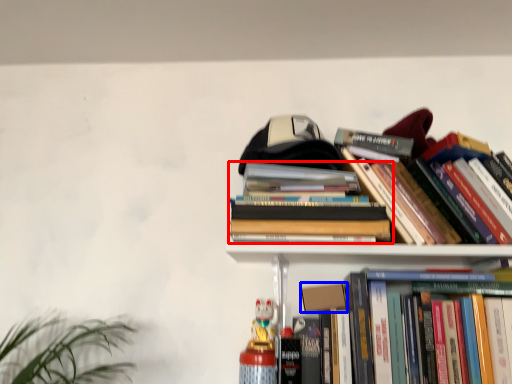
Question: Which object is further to the camera taking this photo, book (highlighted by a red box) or paperback book (highlighted by a blue box)?

Choices:
 (A) book
 (B) paperback book

Answer: (B)